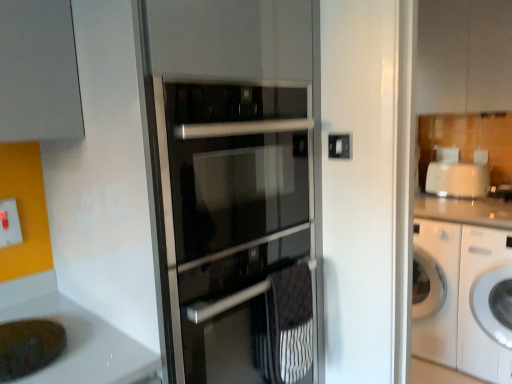
Question: Is white plastic electric outlet at lower left positioned with its back to white glossy washing machine at right?

Choices:
 (A) no
 (B) yes

Answer: (A)

Question: Is white plastic electric outlet at lower left not near white glossy washing machine at right?

Choices:
 (A) no
 (B) yes

Answer: (B)

Question: Is white plastic electric outlet at lower left bigger than white glossy washing machine at right?

Choices:
 (A) yes
 (B) no

Answer: (B)

Question: Does white plastic electric outlet at lower left have a lesser width compared to white glossy washing machine at right?

Choices:
 (A) no
 (B) yes

Answer: (B)

Question: Does white plastic electric outlet at lower left lie in front of white glossy washing machine at right?

Choices:
 (A) no
 (B) yes

Answer: (B)

Question: From the image's perspective, is white plastic electric outlet at lower left beneath white glossy washing machine at right?

Choices:
 (A) yes
 (B) no

Answer: (B)

Question: Is black textured towel at center to the left of white plastic electric outlet at lower left from the viewer's perspective?

Choices:
 (A) yes
 (B) no

Answer: (B)

Question: Can you see black textured towel at center touching white plastic electric outlet at lower left?

Choices:
 (A) yes
 (B) no

Answer: (B)

Question: Is the depth of black textured towel at center greater than that of white plastic electric outlet at lower left?

Choices:
 (A) yes
 (B) no

Answer: (B)

Question: Is black textured towel at center positioned far away from white plastic electric outlet at lower left?

Choices:
 (A) yes
 (B) no

Answer: (B)

Question: Is black textured towel at center outside of white plastic electric outlet at lower left?

Choices:
 (A) yes
 (B) no

Answer: (A)

Question: Does black textured towel at center have a greater width compared to white plastic electric outlet at lower left?

Choices:
 (A) yes
 (B) no

Answer: (A)

Question: Is white glossy cabinet at upper center in contact with white glossy washing machine at right?

Choices:
 (A) yes
 (B) no

Answer: (B)